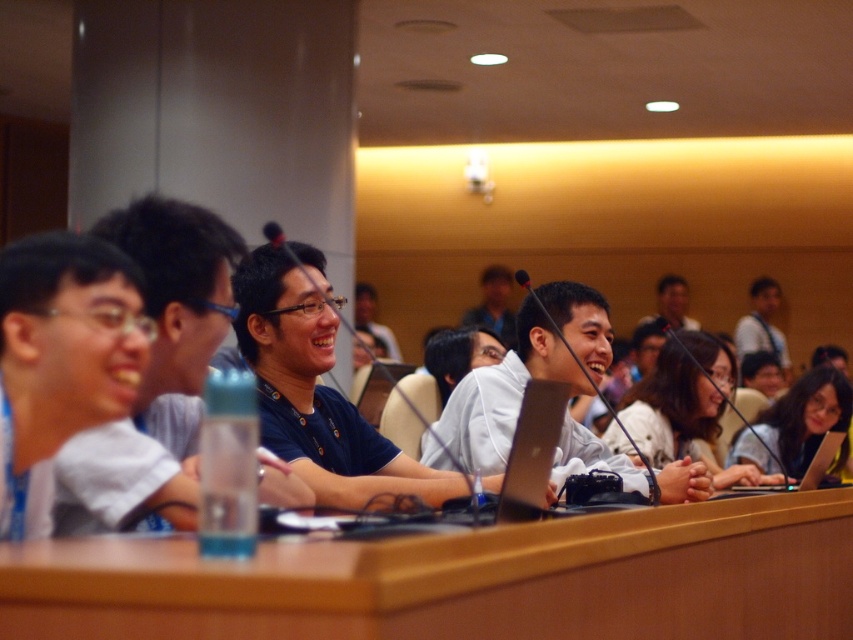
You are standing at the entrance of the conference room and see the point marked at coordinates [463,579]. What object is located at that point?

The point at coordinates [463,579] marks the brown wood table at center.

You are a photographer standing at the back of the conference room. You want to take a photo of the brown wood table at center and the silver metallic laptop at lower right. However, you notice that the laptop is blocking part of the table. Can you determine if the laptop is in front of or behind the table?

The brown wood table at center is positioned under the silver metallic laptop at lower right, meaning the laptop is in front of the table and blocking its view.